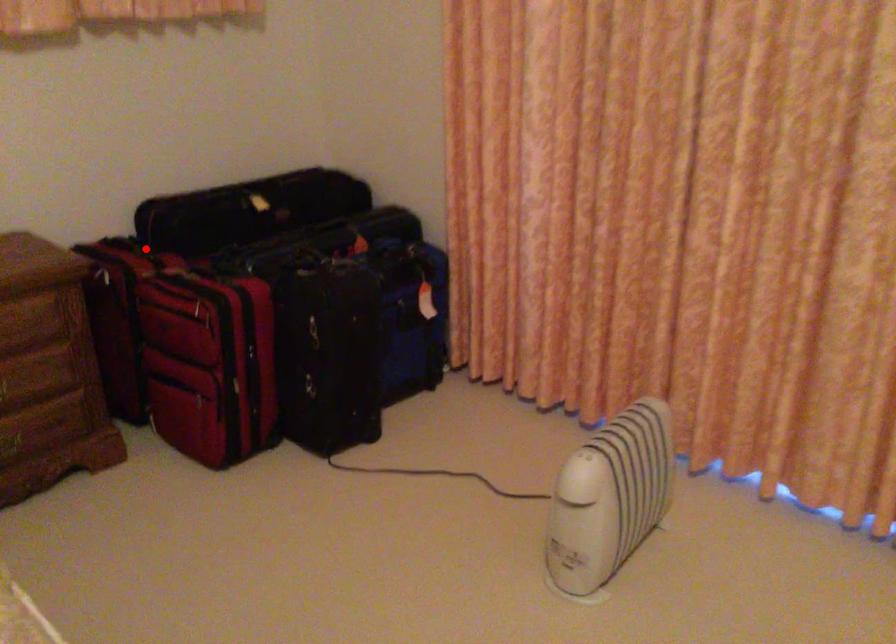
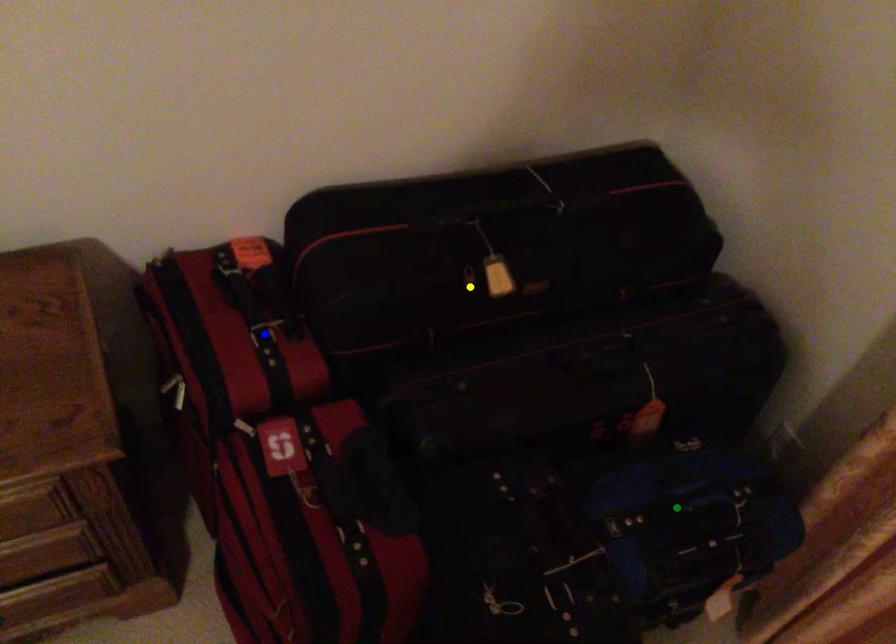
Question: I am providing you with two images of the same scene from different viewpoints. A red point is marked on the first image. You are given multiple points on the second image. Which mark in image 2 goes with the point in image 1?

Choices:
 (A) green point
 (B) yellow point
 (C) blue point

Answer: (C)